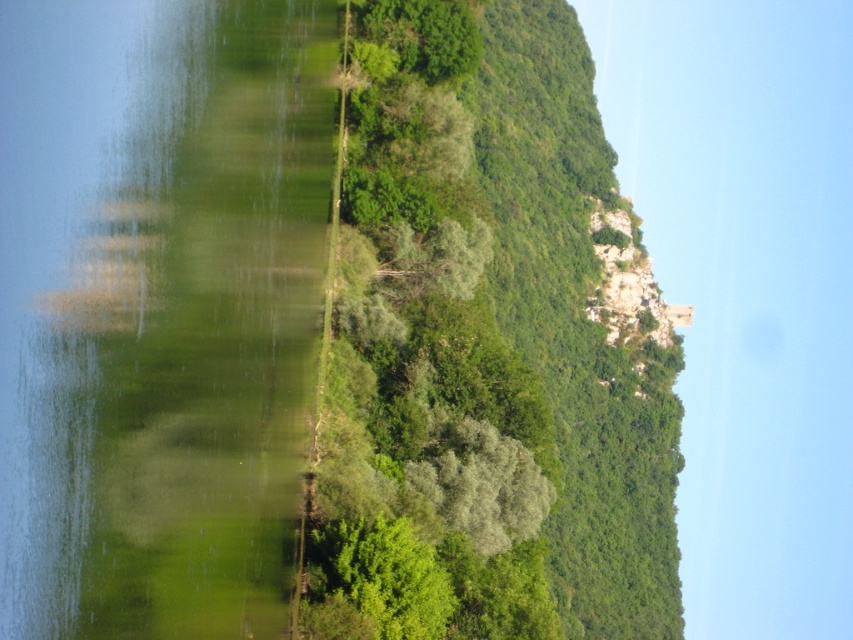
Who is positioned more to the right, green reflective water at left or green leafy tree at center?

green leafy tree at center

Does green reflective water at left have a lesser height compared to green leafy tree at center?

Yes.

Does point (177, 614) come closer to viewer compared to point (374, 51)?

Yes, it is.

Find the location of a particular element. green reflective water at left is located at coordinates (158, 310).